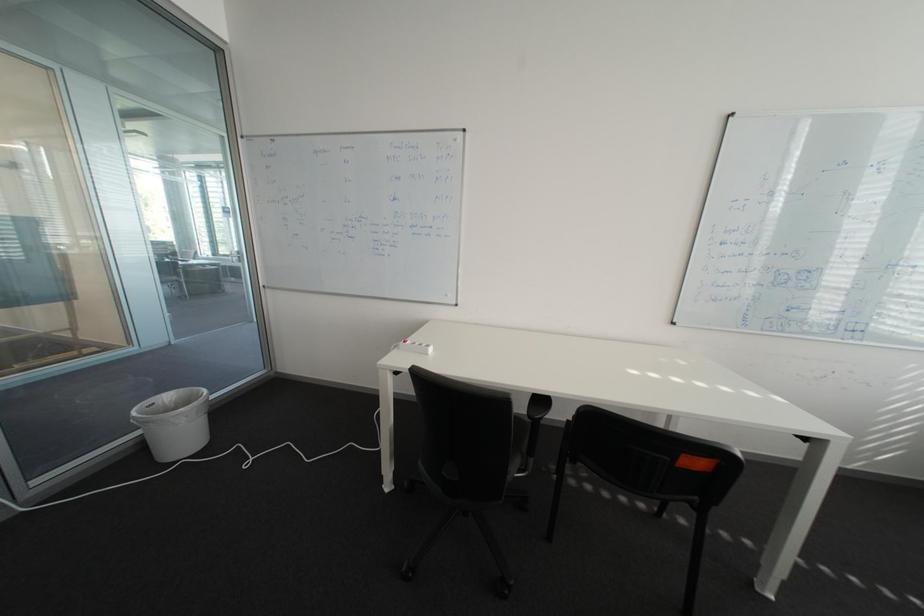
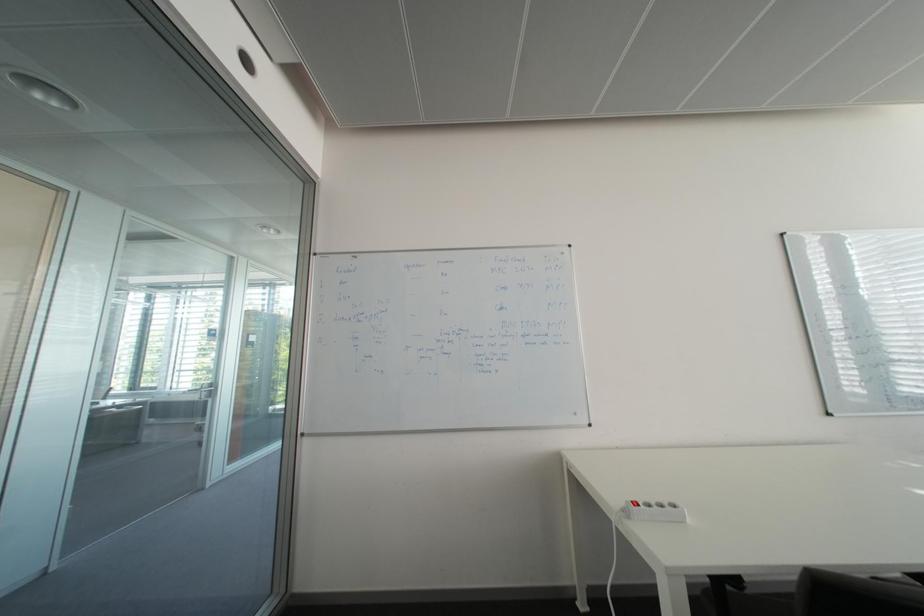
Question: Which direction would the cameraman need to move to produce the second image? Reply with the corresponding letter.

Choices:
 (A) Left
 (B) Right
 (C) Forward
 (D) Backward

Answer: (A)